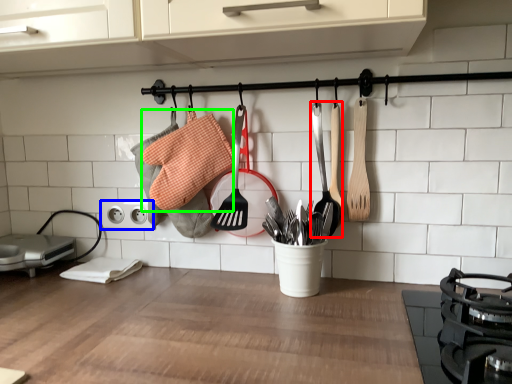
Question: Based on their relative distances, which object is farther from spatula (highlighted by a red box)? Choose from electric outlet (highlighted by a blue box) and material (highlighted by a green box).

Choices:
 (A) electric outlet
 (B) material

Answer: (A)